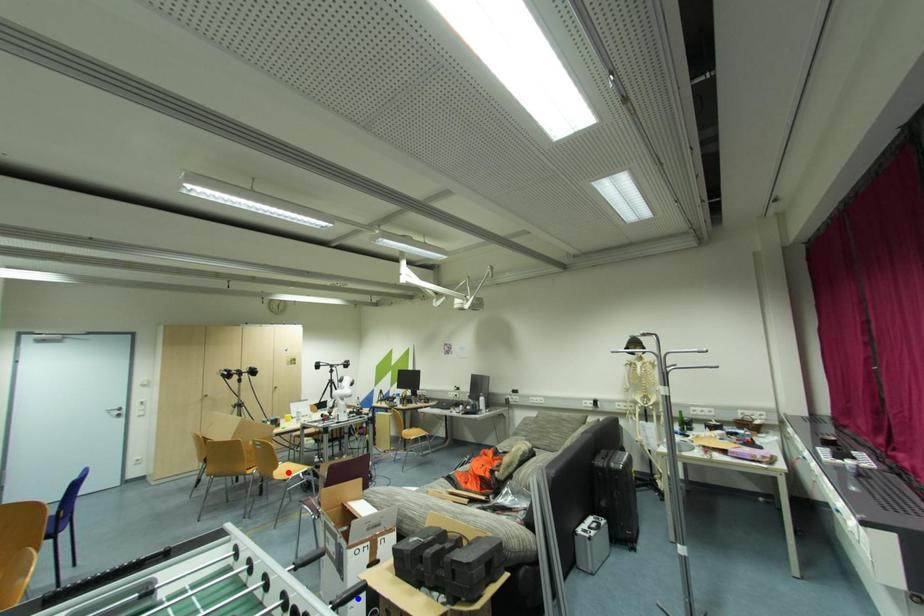
Question: Which of the two points in the image is closer to the camera?

Choices:
 (A) Blue point is closer.
 (B) Red point is closer.

Answer: (A)